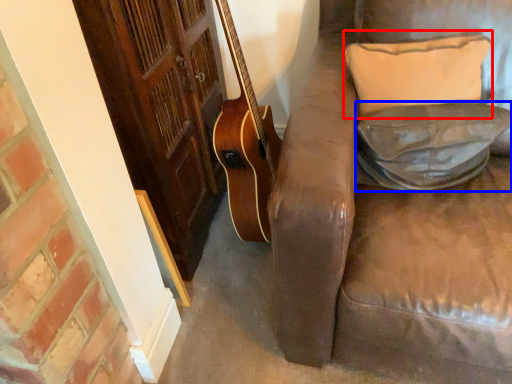
Question: Which of the following is the farthest to the observer, pillow (highlighted by a red box) or pillow (highlighted by a blue box)?

Choices:
 (A) pillow
 (B) pillow

Answer: (A)